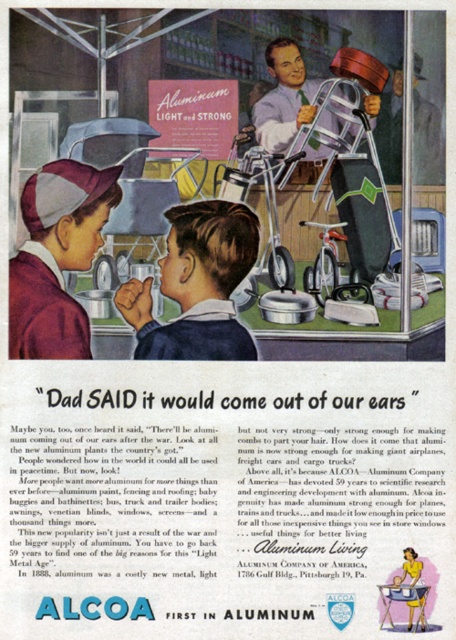
You are standing in front of the store display case in the vintage Alcoa Aluminum advertisement. You notice a point marked at coordinates (x=57, y=257). Which object from the scene is located exactly at this point?

The point at (x=57, y=257) corresponds to the maroon fabric baseball cap at center left.

You are standing in front of the Alcoa Aluminum advertisement and notice two points marked on the image. According to the coordinates, which point is closer to you, point (139,289) or point (428,147)?

Point (139,289) is in front of point (428,147), so it is closer to you.

You are standing in front of the Alcoa Aluminum advertisement. You notice two points marked on the image. The first point is at coordinates point (61, 234) and the second is at point (392, 109). If you were to draw a straight line between these two points, which point would be closer to the bottom edge of the advertisement?

Point (61, 234) is closer to the bottom edge of the advertisement because it has a lower y coordinate than point (392, 109).